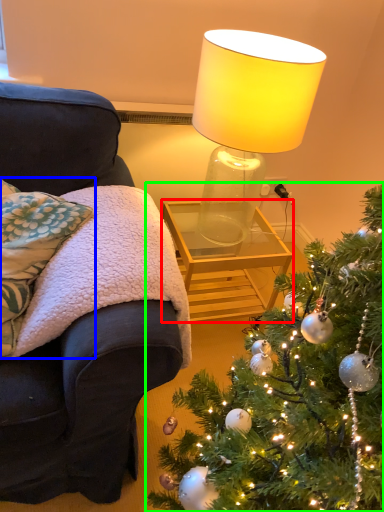
Question: Considering the real-world distances, which object is farthest from table (highlighted by a red box)? pillow (highlighted by a blue box) or christmas tree (highlighted by a green box)?

Choices:
 (A) pillow
 (B) christmas tree

Answer: (B)